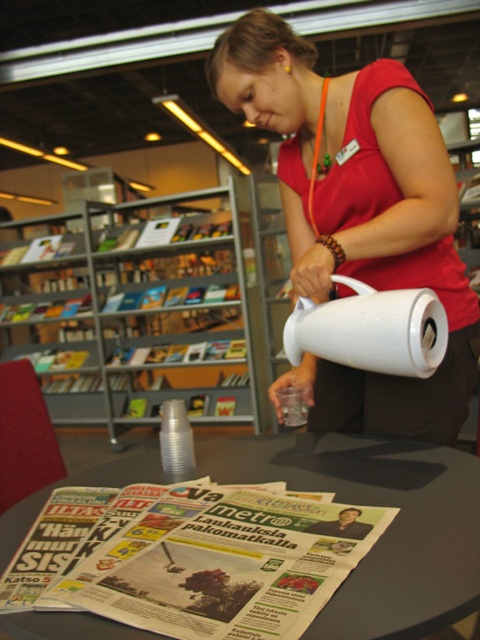
Question: Is black plastic table at lower center below white matte jug at center?

Choices:
 (A) no
 (B) yes

Answer: (B)

Question: Which point is closer to the camera?

Choices:
 (A) (406, 344)
 (B) (420, 588)
 (C) (116, 397)
 (D) (257, 120)

Answer: (B)

Question: Which of the following is the closest to the observer?

Choices:
 (A) black plastic table at lower center
 (B) metallic gray bookshelf at left
 (C) white matte jug at center

Answer: (A)

Question: Can you confirm if metallic gray bookshelf at left is thinner than white matte jug at center?

Choices:
 (A) no
 (B) yes

Answer: (A)

Question: Estimate the real-world distances between objects in this image. Which object is closer to the white glossy pitcher at center?

Choices:
 (A) white matte jug at center
 (B) black plastic table at lower center

Answer: (A)

Question: Observing the image, what is the correct spatial positioning of white glossy pitcher at center in reference to black plastic table at lower center?

Choices:
 (A) left
 (B) right

Answer: (B)